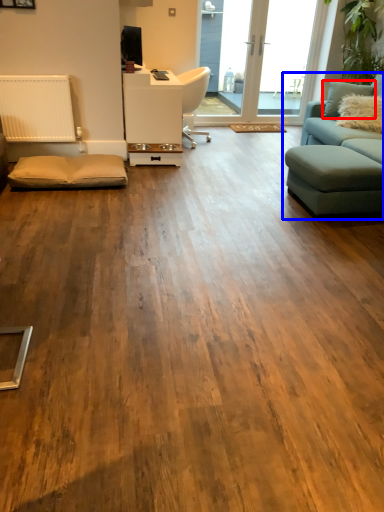
Question: Which point is closer to the camera, pillow (highlighted by a red box) or studio couch (highlighted by a blue box)?

Choices:
 (A) pillow
 (B) studio couch

Answer: (B)